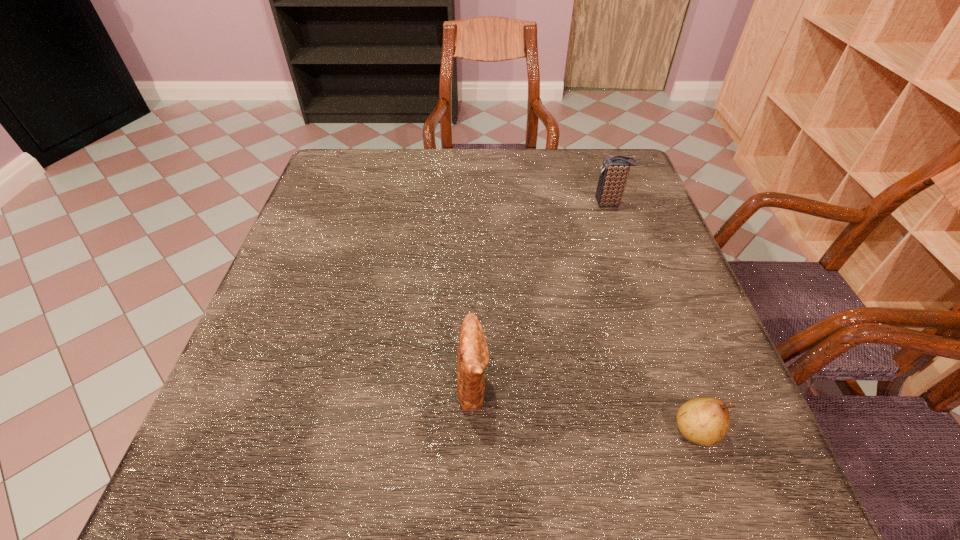
You are a GUI agent. You are given a task and a screenshot of the screen. Output one action in this format:
    pyautogui.click(x=<x>, y=<y>)
    Task: Click on the farthest object
    The image size is (960, 540).
    Given the screenshot: What is the action you would take?
    pyautogui.click(x=614, y=171)

What are the coordinates of `the farther clutch bag` in the screenshot? It's located at (614, 171).

At what (x,y) coordinates should I click in order to perform the action: click on the leftmost object. Please return your answer as a coordinate pair (x, y). Image resolution: width=960 pixels, height=540 pixels. Looking at the image, I should click on (472, 355).

This screenshot has height=540, width=960. Identify the location of the nearer clutch bag. (472, 355).

You are a GUI agent. You are given a task and a screenshot of the screen. Output one action in this format:
    pyautogui.click(x=<x>, y=<y>)
    Task: Click on the shortest object
    This screenshot has height=540, width=960.
    Given the screenshot: What is the action you would take?
    pyautogui.click(x=704, y=421)

Image resolution: width=960 pixels, height=540 pixels. In order to click on vacant space located 0.220m with the zip open on the farthest object in this screenshot , I will do [506, 204].

The image size is (960, 540). Find the location of `free location located with the zip open on the farthest object`. free location located with the zip open on the farthest object is located at coordinates (534, 204).

I want to click on blank space located with the zip open on the farthest object, so click(x=444, y=204).

Find the location of a particular element. This screenshot has width=960, height=540. vacant space located on the open side of the leftmost object is located at coordinates (598, 384).

Where is `free region located on the back of the shortest object`? free region located on the back of the shortest object is located at coordinates (661, 333).